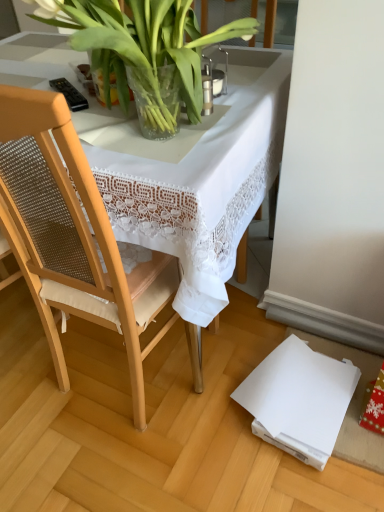
Where is `free point in front of wooden chair at left`? This screenshot has height=512, width=384. free point in front of wooden chair at left is located at coordinates (134, 456).